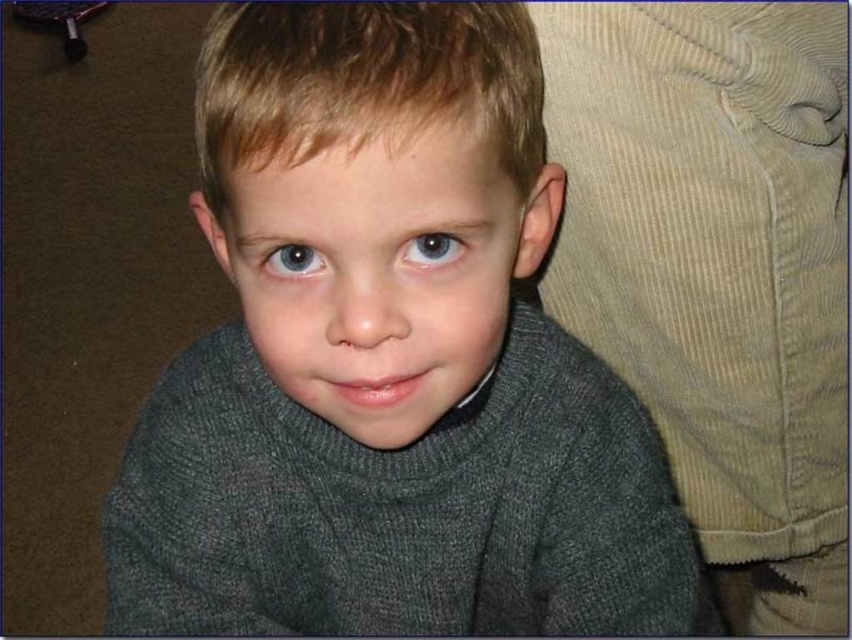
Question: Does dark gray sweater at center appear under blue glossy eye at center?

Choices:
 (A) no
 (B) yes

Answer: (B)

Question: Which object appears farthest from the camera in this image?

Choices:
 (A) matte gray sweater at center
 (B) blue matte eye at upper left
 (C) blue glossy eye at center

Answer: (B)

Question: Which point is closer to the camera?

Choices:
 (A) (435, 234)
 (B) (842, 461)

Answer: (A)

Question: Which object is closer to the camera taking this photo?

Choices:
 (A) blue matte eye at upper left
 (B) corduroy fabric at right
 (C) blue glossy eye at center
 (D) dark gray sweater at center

Answer: (D)

Question: Is corduroy fabric at right positioned at the back of matte gray sweater at center?

Choices:
 (A) yes
 (B) no

Answer: (A)

Question: Does corduroy fabric at right have a smaller size compared to matte gray sweater at center?

Choices:
 (A) no
 (B) yes

Answer: (A)